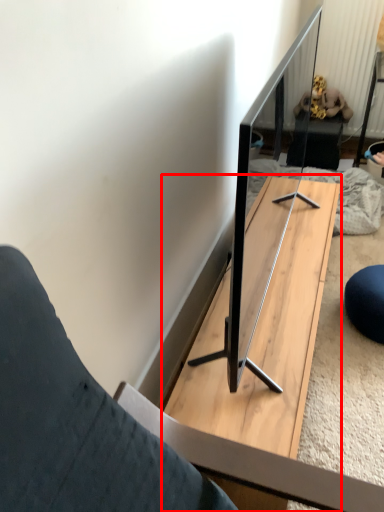
Question: From the image, what is the correct spatial relationship of table (annotated by the red box) in relation to person?

Choices:
 (A) left
 (B) right

Answer: (A)